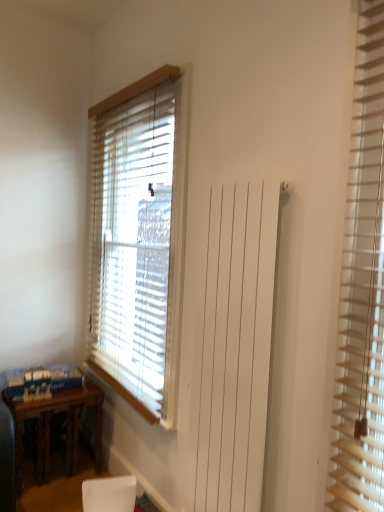
Question: Should I look upward or downward to see white matte armchair at lower center?

Choices:
 (A) down
 (B) up

Answer: (A)

Question: From a real-world perspective, is white matte armchair at lower center physically above wooden blinds at center, the first window blind viewed from the back?

Choices:
 (A) yes
 (B) no

Answer: (B)

Question: Can you confirm if white matte armchair at lower center is positioned to the right of wooden blinds at center, which appears as the second window blind when viewed from the right?

Choices:
 (A) yes
 (B) no

Answer: (B)

Question: Is white matte armchair at lower center positioned in front of wooden blinds at center, the first window blind viewed from the back?

Choices:
 (A) yes
 (B) no

Answer: (A)

Question: Can you confirm if white matte armchair at lower center is shorter than wooden blinds at center, which is counted as the 1th window blind, starting from the left?

Choices:
 (A) yes
 (B) no

Answer: (A)

Question: From a real-world perspective, is white matte armchair at lower center located beneath wooden blinds at center, which is counted as the 2th window blind, starting from the front?

Choices:
 (A) no
 (B) yes

Answer: (B)

Question: Is white matte armchair at lower center completely or partially outside of wooden blinds at center, the first window blind viewed from the back?

Choices:
 (A) yes
 (B) no

Answer: (A)

Question: Considering the relative positions of white matte armchair at lower center and brown wooden table at lower left in the image provided, is white matte armchair at lower center behind brown wooden table at lower left?

Choices:
 (A) no
 (B) yes

Answer: (A)

Question: Is white matte armchair at lower center not inside brown wooden table at lower left?

Choices:
 (A) no
 (B) yes

Answer: (B)

Question: Could you tell me if white matte armchair at lower center is facing brown wooden table at lower left?

Choices:
 (A) no
 (B) yes

Answer: (A)

Question: Is white matte armchair at lower center turned away from brown wooden table at lower left?

Choices:
 (A) no
 (B) yes

Answer: (B)

Question: From the image's perspective, is white matte armchair at lower center above brown wooden table at lower left?

Choices:
 (A) no
 (B) yes

Answer: (A)

Question: Does white matte armchair at lower center appear on the left side of brown wooden table at lower left?

Choices:
 (A) no
 (B) yes

Answer: (A)

Question: From a real-world perspective, is brown wooden table at lower left located higher than white matte armchair at lower center?

Choices:
 (A) no
 (B) yes

Answer: (B)